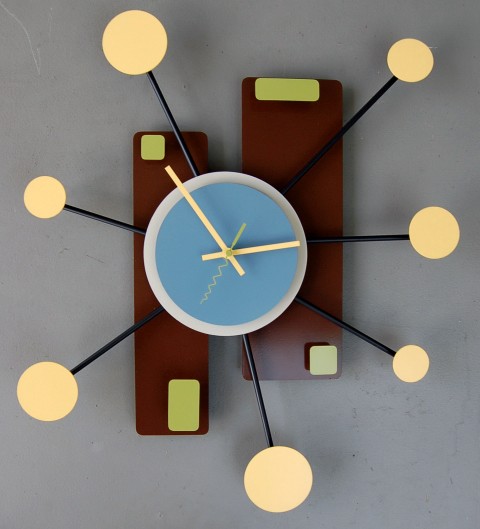
You are a GUI agent. You are given a task and a screenshot of the screen. Output one action in this format:
    pyautogui.click(x=<x>, y=<y>)
    Task: Click on the empty space bottom right of wall
    The image size is (480, 529).
    Given the screenshot: What is the action you would take?
    pyautogui.click(x=395, y=473)